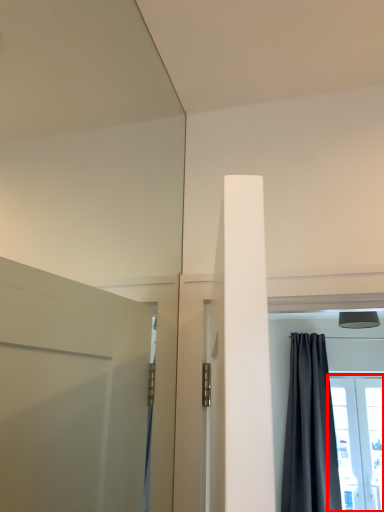
Question: From the image's perspective, considering the relative positions of window (annotated by the red box) and curtain in the image provided, where is window (annotated by the red box) located with respect to the staircase?

Choices:
 (A) below
 (B) above

Answer: (A)